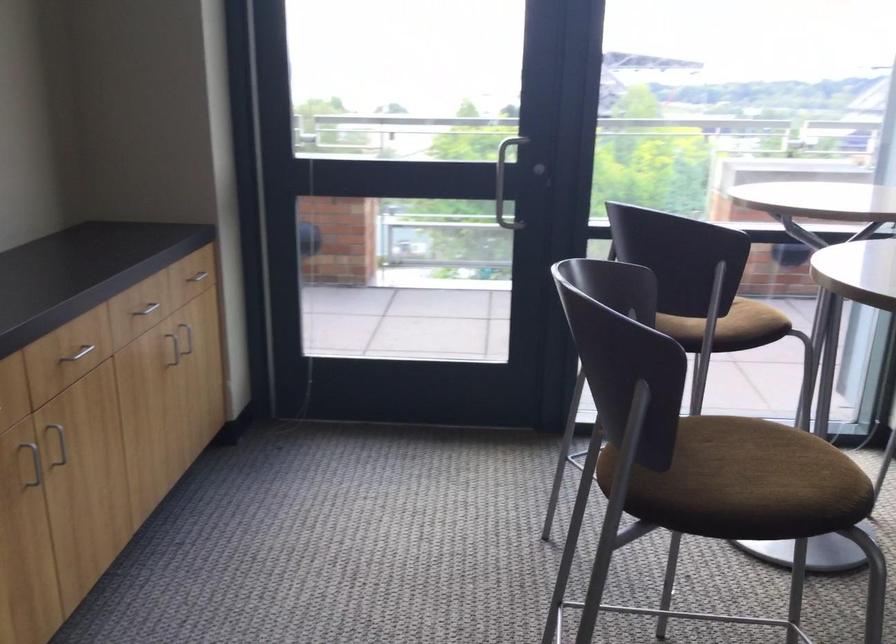
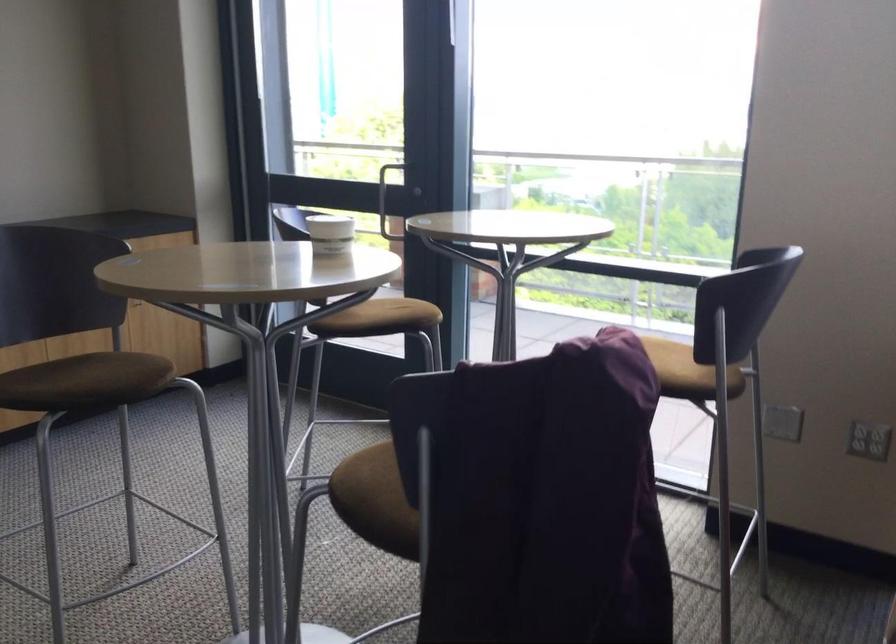
Question: I am providing you with two images of the same scene from different viewpoints. After the viewpoint changes to image2, which objects are now occluded?

Choices:
 (A) white paper cup
 (B) grey shoe
 (C) metal door handle
 (D) silver drawer handle

Answer: (D)